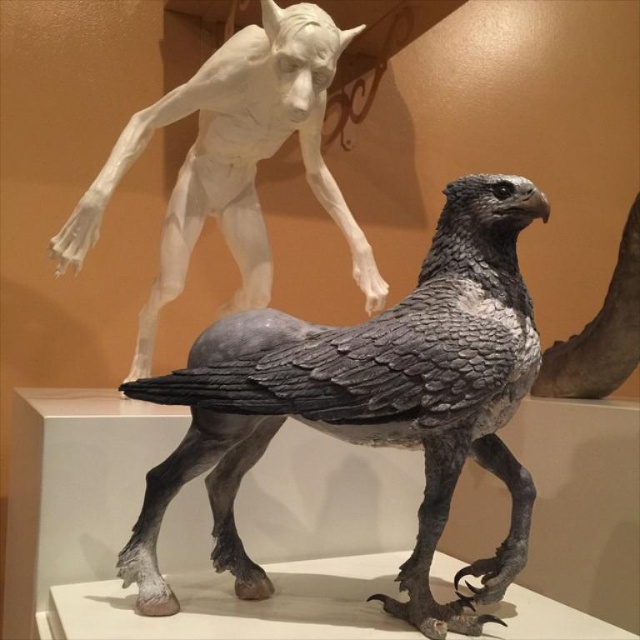
Between point (198, 448) and point (104, 202), which one is positioned behind?

Point (104, 202)

I want to click on gray textured eagle at center, so click(380, 403).